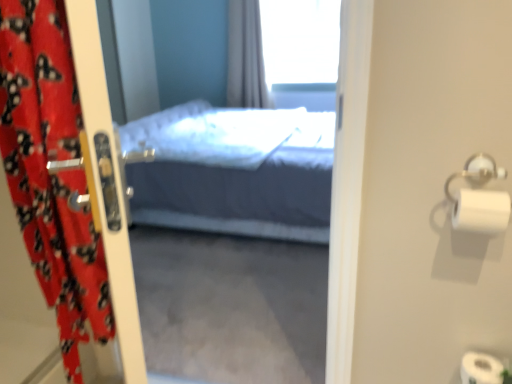
Question: Is point (7, 139) closer or farther from the camera than point (465, 170)?

Choices:
 (A) closer
 (B) farther

Answer: (A)

Question: Is red fabric curtain at left in front of or behind silver metallic towel bar at right in the image?

Choices:
 (A) front
 (B) behind

Answer: (A)

Question: Considering the real-world distances, which object is farthest from the white matte toilet paper at right?

Choices:
 (A) transparent glass window at upper center
 (B) red fabric curtain at left
 (C) silver metallic towel bar at right

Answer: (A)

Question: Which is nearer to the red fabric curtain at left?

Choices:
 (A) transparent glass window at upper center
 (B) white matte toilet paper at right
 (C) silver metallic towel bar at right

Answer: (B)